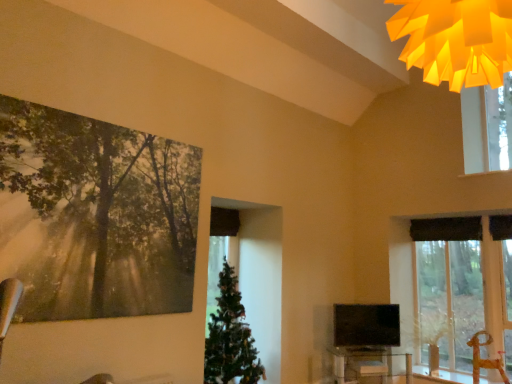
Question: Is clear glass table at lower center not within metallic silver swivel chair at lower right?

Choices:
 (A) no
 (B) yes

Answer: (B)

Question: From a real-world perspective, is clear glass table at lower center located beneath metallic silver swivel chair at lower right?

Choices:
 (A) yes
 (B) no

Answer: (A)

Question: Considering the relative positions of clear glass table at lower center and metallic silver swivel chair at lower right in the image provided, is clear glass table at lower center behind metallic silver swivel chair at lower right?

Choices:
 (A) yes
 (B) no

Answer: (B)

Question: Considering the relative sizes of clear glass table at lower center and metallic silver swivel chair at lower right in the image provided, is clear glass table at lower center wider than metallic silver swivel chair at lower right?

Choices:
 (A) yes
 (B) no

Answer: (A)

Question: Considering the relative sizes of clear glass table at lower center and metallic silver swivel chair at lower right in the image provided, is clear glass table at lower center shorter than metallic silver swivel chair at lower right?

Choices:
 (A) yes
 (B) no

Answer: (A)

Question: From a real-world perspective, is matte forest painting at upper left positioned above or below matte black tv at center?

Choices:
 (A) below
 (B) above

Answer: (B)

Question: Is matte forest painting at upper left situated inside matte black tv at center or outside?

Choices:
 (A) outside
 (B) inside

Answer: (A)

Question: In terms of size, does matte forest painting at upper left appear bigger or smaller than matte black tv at center?

Choices:
 (A) big
 (B) small

Answer: (A)

Question: From the image's perspective, is matte forest painting at upper left above or below matte black tv at center?

Choices:
 (A) below
 (B) above

Answer: (B)

Question: From the image's perspective, is matte forest painting at upper left above or below clear glass table at lower center?

Choices:
 (A) above
 (B) below

Answer: (A)

Question: Is point (130, 198) closer or farther from the camera than point (390, 362)?

Choices:
 (A) farther
 (B) closer

Answer: (B)

Question: Which is correct: matte forest painting at upper left is inside clear glass table at lower center, or outside of it?

Choices:
 (A) inside
 (B) outside

Answer: (B)

Question: Looking at the image, does matte forest painting at upper left seem bigger or smaller compared to clear glass table at lower center?

Choices:
 (A) small
 (B) big

Answer: (A)

Question: Relative to green matte christmas tree at center, is matte black tv at center in front or behind?

Choices:
 (A) front
 (B) behind

Answer: (B)

Question: From a real-world perspective, is matte black tv at center physically located above or below green matte christmas tree at center?

Choices:
 (A) below
 (B) above

Answer: (A)